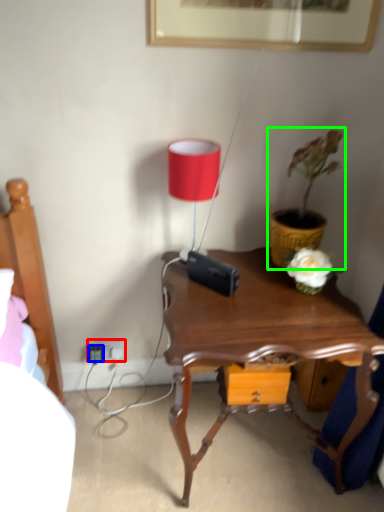
Question: Which is nearer to the electric outlet (highlighted by a red box)? plug (highlighted by a blue box) or houseplant (highlighted by a green box).

Choices:
 (A) plug
 (B) houseplant

Answer: (A)